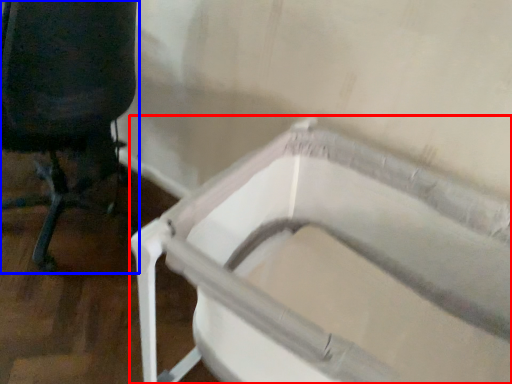
Question: Which of the following is the closest to the observer, bath (highlighted by a red box) or chair (highlighted by a blue box)?

Choices:
 (A) bath
 (B) chair

Answer: (A)